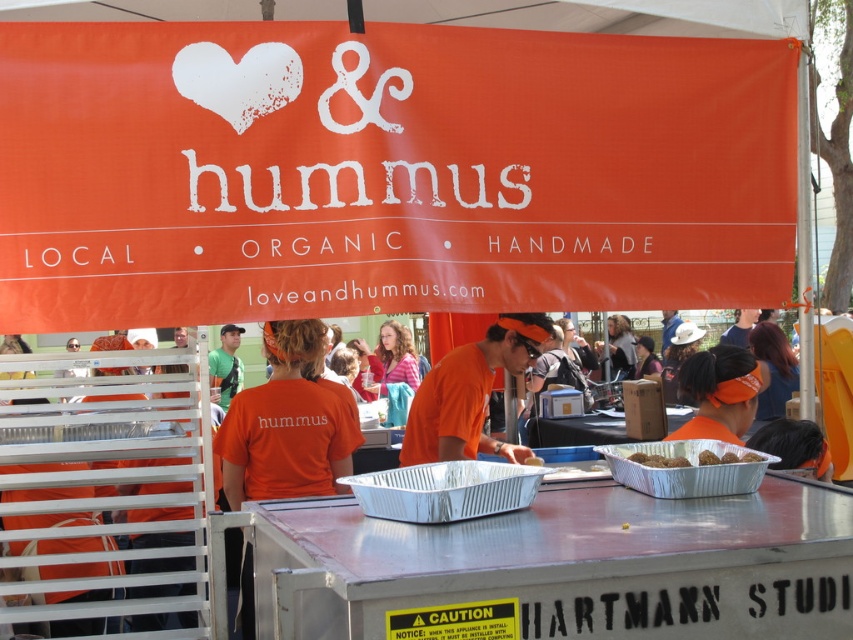
You are a customer at the market and want to buy the brown matte balls at center. The vendor is wearing an orange fabric shirt at center. How can you tell the vendor you want to purchase the balls?

The orange fabric shirt at center is much taller as brown matte balls at center, so you can approach the vendor by addressing them directly since they are standing above the brown matte balls at center.